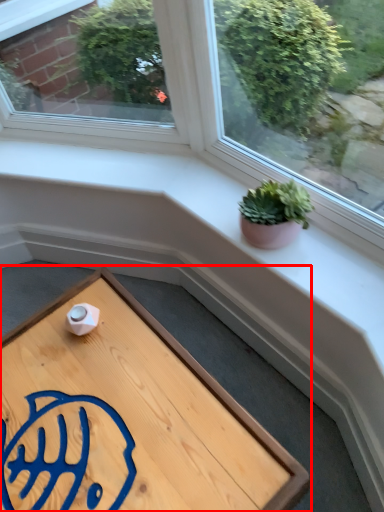
Question: In this image, where is table (annotated by the red box) located relative to houseplant?

Choices:
 (A) left
 (B) right

Answer: (A)